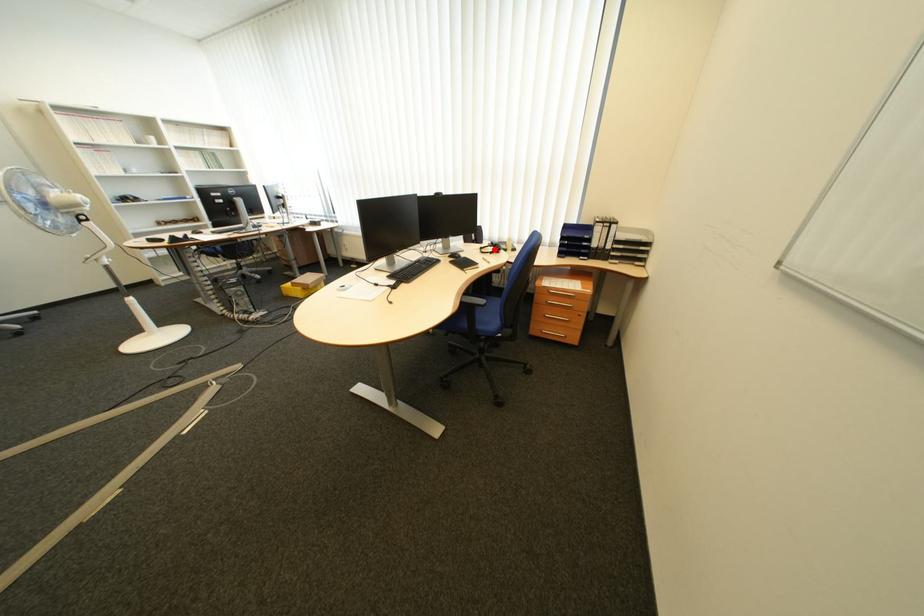
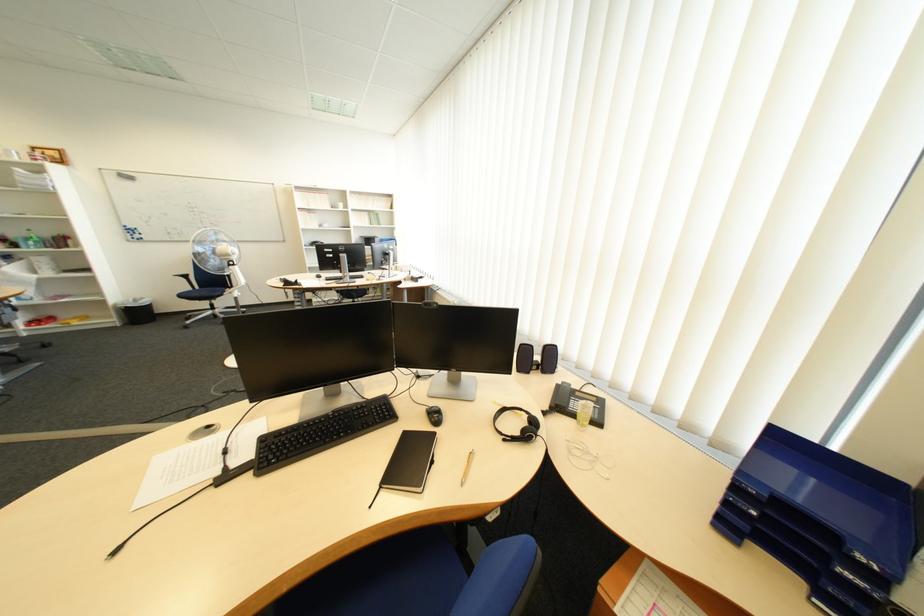
In the second image, find the point that corresponds to the highlighted location in the first image.

(517, 411)